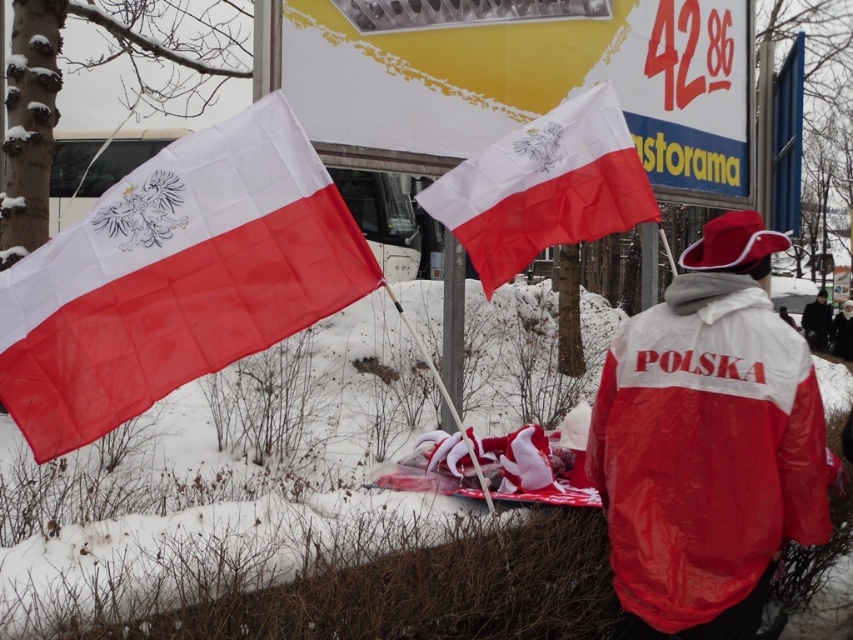
Describe the element at coordinates (706, 442) in the screenshot. This screenshot has height=640, width=853. I see `matte red jacket at center` at that location.

Which is below, matte red jacket at center or black leather jacket at right?

Positioned lower is matte red jacket at center.

Between point (657, 307) and point (804, 326), which one is positioned behind?

The point (804, 326) is more distant.

In order to click on matte red jacket at center in this screenshot , I will do (706, 442).

Is white fabric flag at left above black leather jacket at right?

Yes.

Can you confirm if white fabric flag at left is smaller than black leather jacket at right?

Yes, white fabric flag at left is smaller than black leather jacket at right.

Who is more forward, (3, 308) or (814, 328)?

Positioned in front is point (3, 308).

Identify the location of white fabric flag at left. (177, 276).

Can you confirm if white fabric flag at left is smaller than matte red jacket at center?

Yes, white fabric flag at left is smaller than matte red jacket at center.

From the picture: Can you confirm if white fabric flag at left is thinner than matte red jacket at center?

In fact, white fabric flag at left might be wider than matte red jacket at center.

Is point (50, 344) behind point (720, 616)?

No, it is in front of (720, 616).

Locate an element on the screen. The width and height of the screenshot is (853, 640). white fabric flag at left is located at coordinates (177, 276).